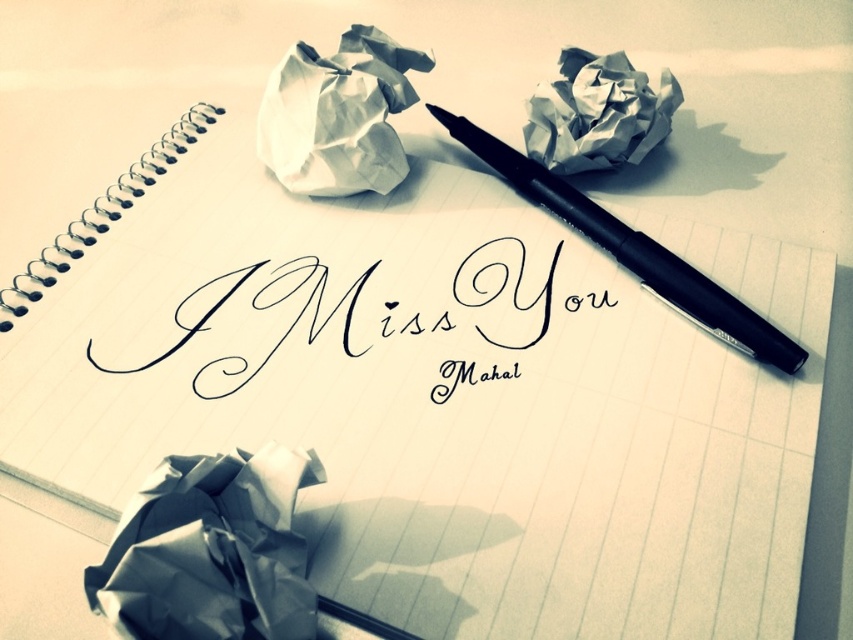
Who is positioned more to the left, black calligraphy at center or black matte pen at center?

Positioned to the left is black calligraphy at center.

Who is more forward, (410, 328) or (502, 176)?

Point (410, 328) is more forward.

Is point (540, 317) more distant than point (595, 218)?

That is False.

The height and width of the screenshot is (640, 853). I want to click on black calligraphy at center, so click(x=258, y=321).

Which is behind, point (386, 177) or point (643, 284)?

Positioned behind is point (386, 177).

The width and height of the screenshot is (853, 640). Identify the location of white crumpled paper at upper center. (338, 115).

Which is behind, point (302, 77) or point (784, 349)?

The point (302, 77) is more distant.

Identify the location of white crumpled paper at upper center. (338, 115).

Can you confirm if black calligraphy at center is taller than white crumpled paper at upper center?

No, black calligraphy at center is not taller than white crumpled paper at upper center.

Can you confirm if black calligraphy at center is bigger than white crumpled paper at upper center?

Correct, black calligraphy at center is larger in size than white crumpled paper at upper center.

This screenshot has height=640, width=853. Identify the location of black calligraphy at center. (258, 321).